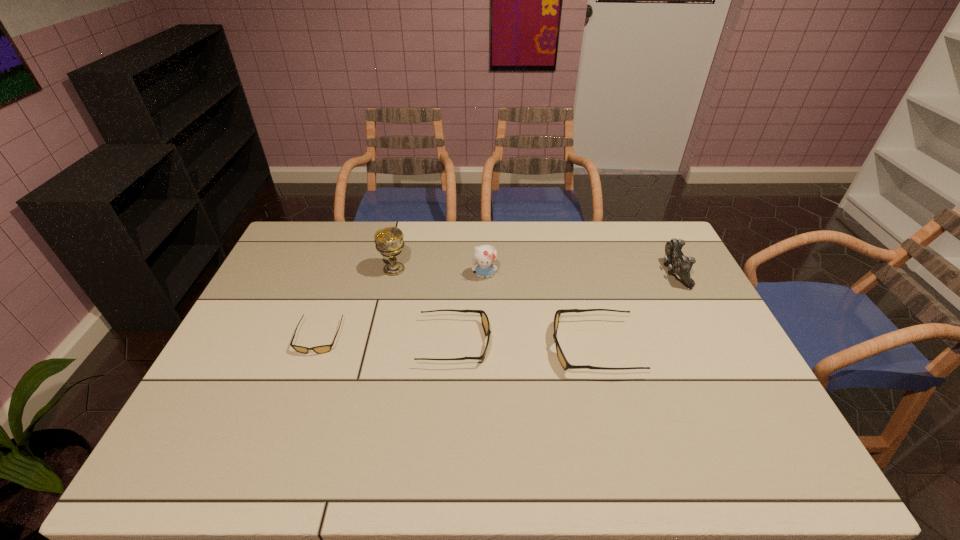
Where is `free spot between the chalice and the rightmost object`? The height and width of the screenshot is (540, 960). free spot between the chalice and the rightmost object is located at coordinates (534, 271).

At what (x,y) coordinates should I click in order to perform the action: click on free point between the shortest object and the rightmost sunglasses. Please return your answer as a coordinate pair (x, y). Looking at the image, I should click on (456, 342).

Find the location of `vacant space that is in between the second object from right to left and the second object from left to right`. vacant space that is in between the second object from right to left and the second object from left to right is located at coordinates (493, 308).

This screenshot has height=540, width=960. Find the location of `vacant point located between the rightmost sunglasses and the third tallest object`. vacant point located between the rightmost sunglasses and the third tallest object is located at coordinates (634, 310).

Image resolution: width=960 pixels, height=540 pixels. In order to click on free space between the second tallest sunglasses and the rightmost object in this screenshot , I will do `click(564, 308)`.

This screenshot has width=960, height=540. In order to click on free spot between the fifth shortest object and the rightmost object in this screenshot , I will do `click(579, 274)`.

Locate an element on the screen. empty space that is in between the fifth object from right to left and the rightmost sunglasses is located at coordinates (493, 308).

This screenshot has width=960, height=540. Find the location of `vacant space that's between the rightmost sunglasses and the chalice`. vacant space that's between the rightmost sunglasses and the chalice is located at coordinates point(493,308).

Select which object appears as the closest to the chalice. Please provide its 2D coordinates. Your answer should be formatted as a tuple, i.e. [(x, y)], where the tuple contains the x and y coordinates of a point satisfying the conditions above.

[(484, 318)]

Find the location of a particular element. The height and width of the screenshot is (540, 960). the fourth closest object relative to the rightmost object is located at coordinates tap(389, 241).